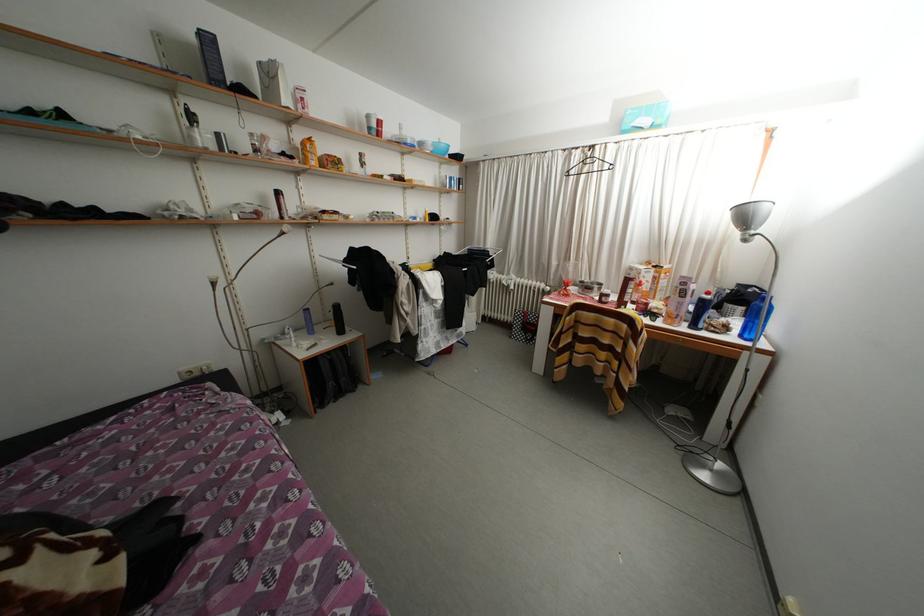
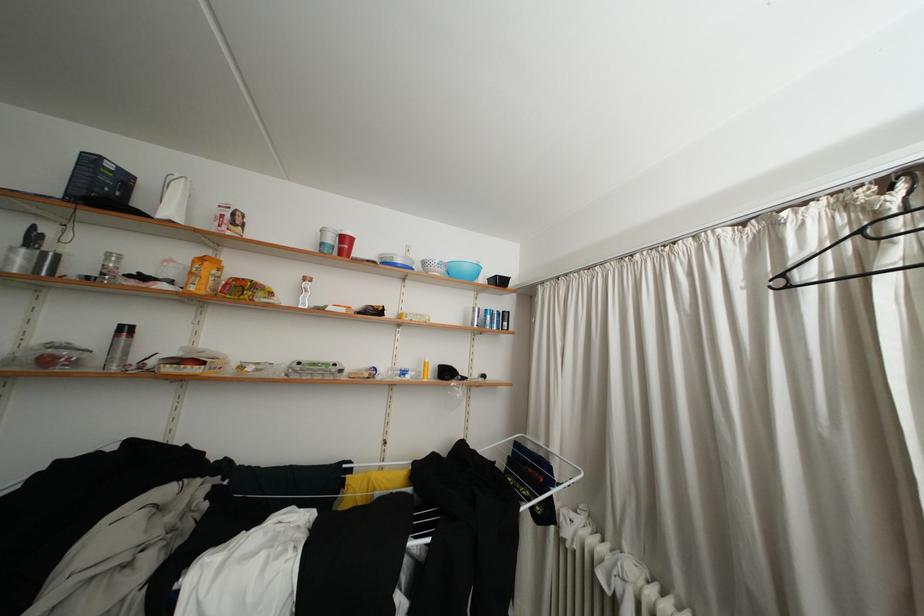
The point at (378, 132) is marked in the first image. Where is the corresponding point in the second image?

(330, 249)